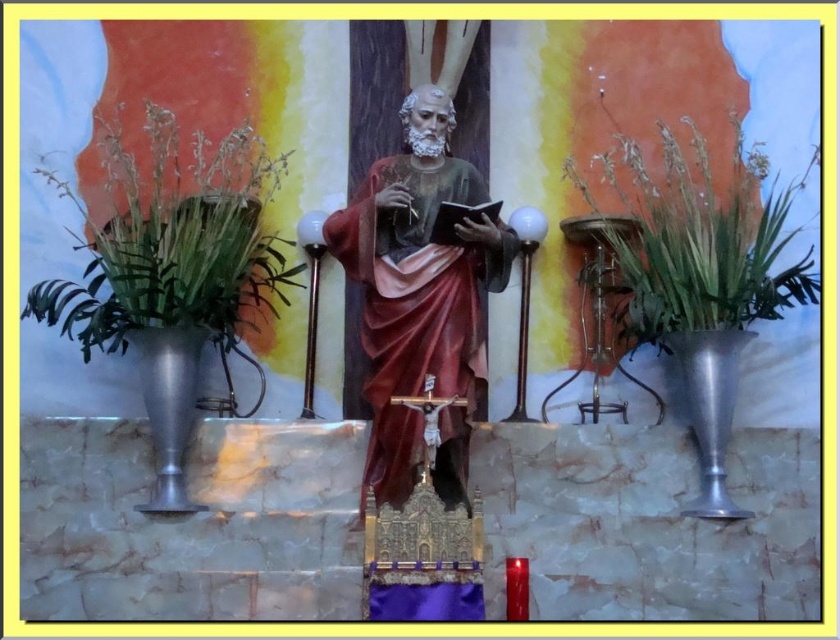
Question: Can you confirm if matte wood statue at center is positioned above metallic vase at left?

Choices:
 (A) no
 (B) yes

Answer: (A)

Question: Which object appears farthest from the camera in this image?

Choices:
 (A) metallic vase at left
 (B) matte wood statue at center

Answer: (A)

Question: Where is matte wood statue at center located in relation to metallic vase at left in the image?

Choices:
 (A) left
 (B) right

Answer: (B)

Question: Which of the following is the closest to the observer?

Choices:
 (A) (644, 259)
 (B) (369, 260)
 (C) (108, 310)

Answer: (B)

Question: Which point is closer to the camera taking this photo?

Choices:
 (A) (118, 172)
 (B) (727, 252)

Answer: (B)

Question: Can you confirm if matte wood statue at center is positioned above metallic vase at right?

Choices:
 (A) yes
 (B) no

Answer: (B)